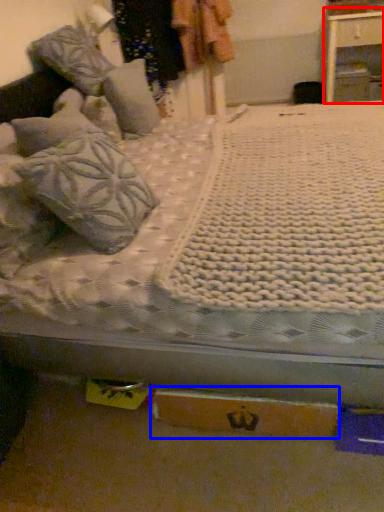
Question: Among these objects, which one is nearest to the camera, nightstand (highlighted by a red box) or cardboard box (highlighted by a blue box)?

Choices:
 (A) nightstand
 (B) cardboard box

Answer: (B)